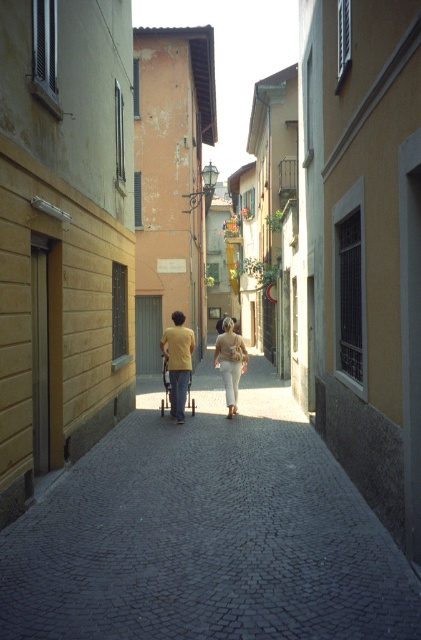
Who is shorter, yellow matte shirt at center or matte beige pants at center?

matte beige pants at center is shorter.

The height and width of the screenshot is (640, 421). What are the coordinates of `yellow matte shirt at center` in the screenshot? It's located at (178, 362).

Where is `yellow matte shirt at center`? The height and width of the screenshot is (640, 421). yellow matte shirt at center is located at coordinates (178, 362).

Does point (194, 337) come in front of point (183, 369)?

No.

Does yellow cotton shirt at center lie in front of yellow matte shirt at center?

No.

Who is more forward, (173,380) or (191,340)?

Point (191,340) is in front.

This screenshot has height=640, width=421. I want to click on yellow cotton shirt at center, so click(176, 360).

Image resolution: width=421 pixels, height=640 pixels. What are the coordinates of `cobblestone alley at center` in the screenshot? It's located at (207, 532).

Is point (335, 548) more distant than point (231, 328)?

No, (335, 548) is in front of (231, 328).

Does point (279, 435) lie in front of point (186, 349)?

Yes, it is.

Identify the location of cobblestone alley at center. (207, 532).